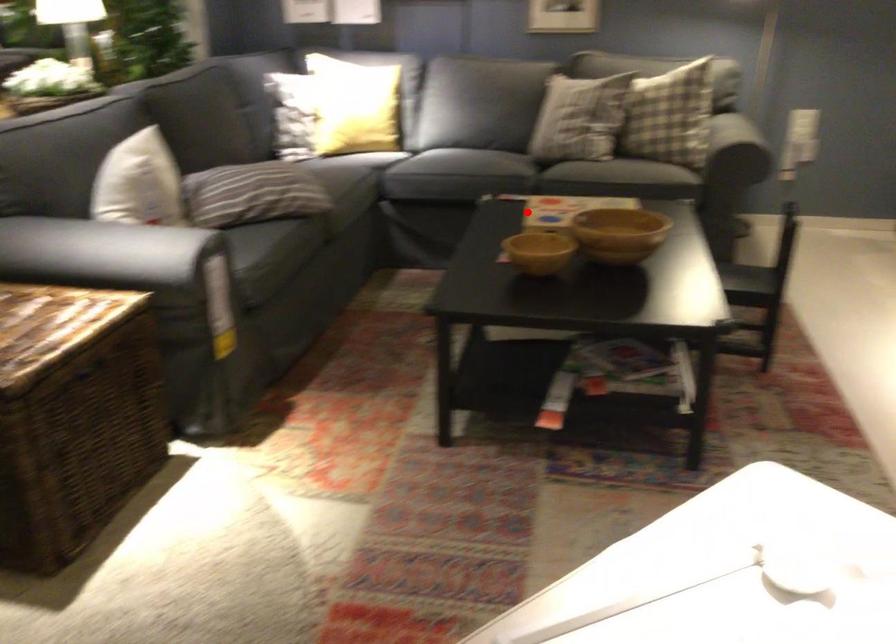
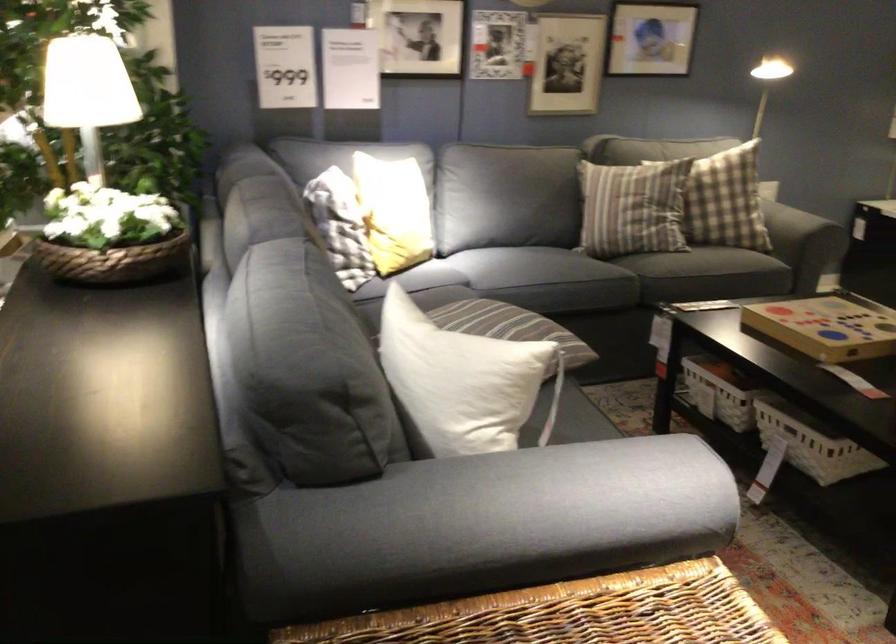
Question: I am providing you with two images of the same scene from different viewpoints. Image1 has a red point marked. In image2, the corresponding 3D location appears at what relative position? Reply with the corresponding letter.

Choices:
 (A) Closer
 (B) Farther

Answer: (A)